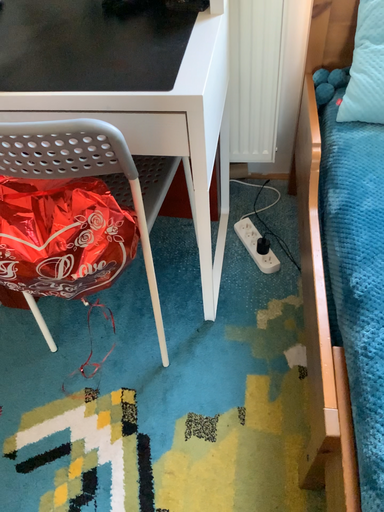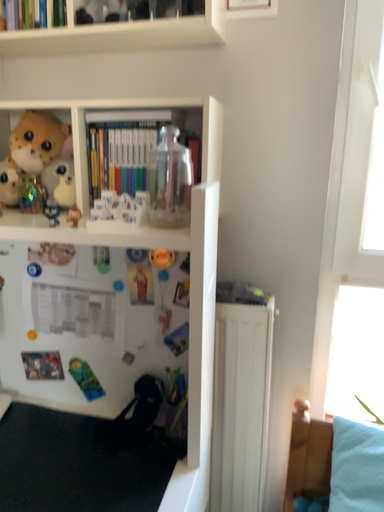
Question: Which way did the camera rotate in the video?

Choices:
 (A) rotated downward
 (B) rotated upward

Answer: (B)